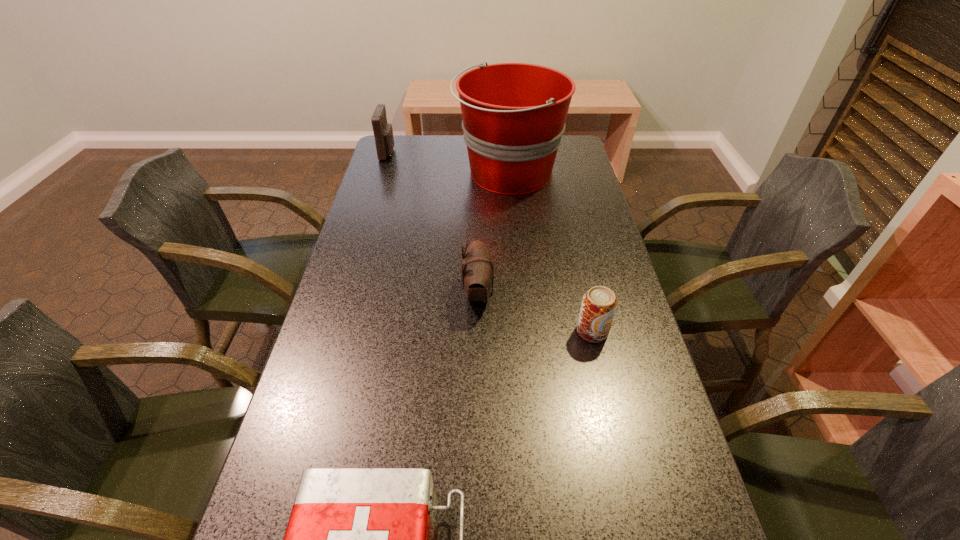
Locate an element on the screen. The height and width of the screenshot is (540, 960). free spot between the left pouch and the fourth farthest object is located at coordinates (490, 242).

This screenshot has width=960, height=540. In order to click on empty location between the tallest object and the shorter pouch in this screenshot , I will do `click(493, 234)`.

Where is `object identified as the closest to the right pouch`? object identified as the closest to the right pouch is located at coordinates (599, 304).

Where is `the closest object to the third nearest object`? the closest object to the third nearest object is located at coordinates (599, 304).

At what (x,y) coordinates should I click in order to perform the action: click on free space that satisfies the following two spatial constraints: 1. with the flap open on the right pouch; 2. on the back side of the second nearest object. Please return your answer as a coordinate pair (x, y). Looking at the image, I should click on (478, 332).

I want to click on free space that satisfies the following two spatial constraints: 1. with an open flap on the tallest object; 2. on the left side of the leftmost object, so click(x=382, y=174).

Find the location of a particular element. Image resolution: width=960 pixels, height=540 pixels. vacant space that satisfies the following two spatial constraints: 1. on the front side of the tallest object; 2. on the right side of the second nearest object is located at coordinates (522, 332).

Where is `free spot that satisfies the following two spatial constraints: 1. with an open flap on the beer can; 2. on the left side of the farther pouch`? This screenshot has width=960, height=540. free spot that satisfies the following two spatial constraints: 1. with an open flap on the beer can; 2. on the left side of the farther pouch is located at coordinates (334, 332).

Where is `vacant space that satisfies the following two spatial constraints: 1. with the flap open on the right pouch; 2. on the left side of the second nearest object`? The image size is (960, 540). vacant space that satisfies the following two spatial constraints: 1. with the flap open on the right pouch; 2. on the left side of the second nearest object is located at coordinates (478, 332).